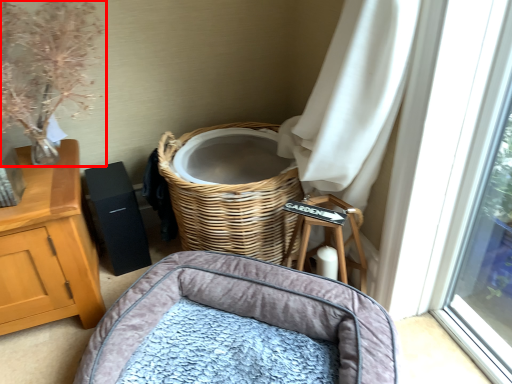
Question: From the image's perspective, where is floral arrangement (annotated by the red box) located in relation to infant bed in the image?

Choices:
 (A) below
 (B) above

Answer: (B)